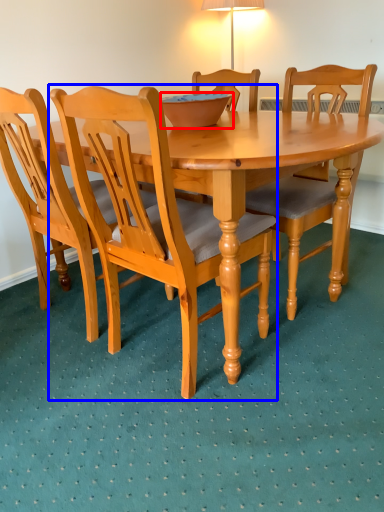
Question: Which object is closer to the camera taking this photo, bowl (highlighted by a red box) or chair (highlighted by a blue box)?

Choices:
 (A) bowl
 (B) chair

Answer: (B)